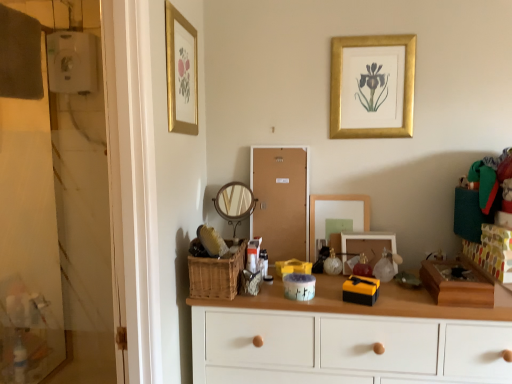
Image resolution: width=512 pixels, height=384 pixels. Identify the location of vacant space to the left of shiny metallic toy at center. (328, 288).